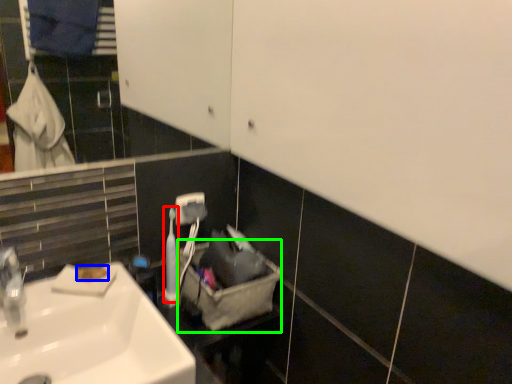
Question: Which object is positioned closest to toiletry (highlighted by a red box)? Select from soap (highlighted by a blue box) and laundry basket (highlighted by a green box).

Choices:
 (A) soap
 (B) laundry basket

Answer: (B)